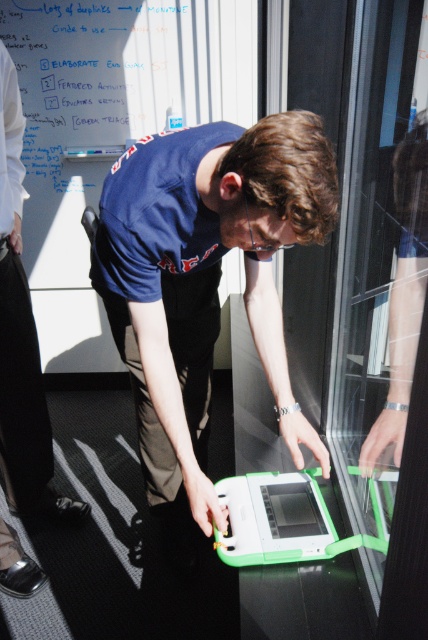
You are designing a layout for a poster that needs to include both the green matte laptop at center and the white cotton shirt at upper left. Given their sizes, which object should be placed first to ensure they both fit on the poster?

The green matte laptop at center is bigger than the white cotton shirt at upper left, so you should place the green matte laptop at center first to ensure there is enough space for both on the poster.

You are designing a layout for a presentation and need to place both the whiteboard at upper left and the white cotton shirt at upper left in the frame. Based on their sizes, which object should be placed first to ensure both fit properly?

The whiteboard at upper left should be placed first since it has a larger width than the white cotton shirt at upper left, ensuring there is enough space for both in the presentation layout.

You are a photographer setting up a shot of the scene described. You need to ensure that both the green matte laptop at center and the white cotton shirt at upper left are clearly visible in the frame. Based on their positions, which object should you position closer to the left side of the camera frame to achieve this?

The white cotton shirt at upper left should be positioned closer to the left side of the camera frame since it is already located to the left of the green matte laptop at center.